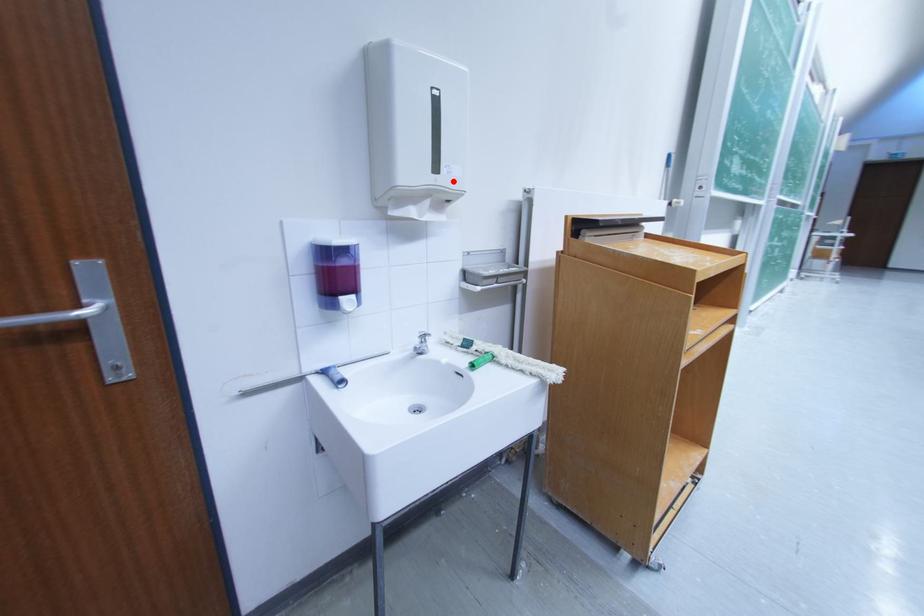
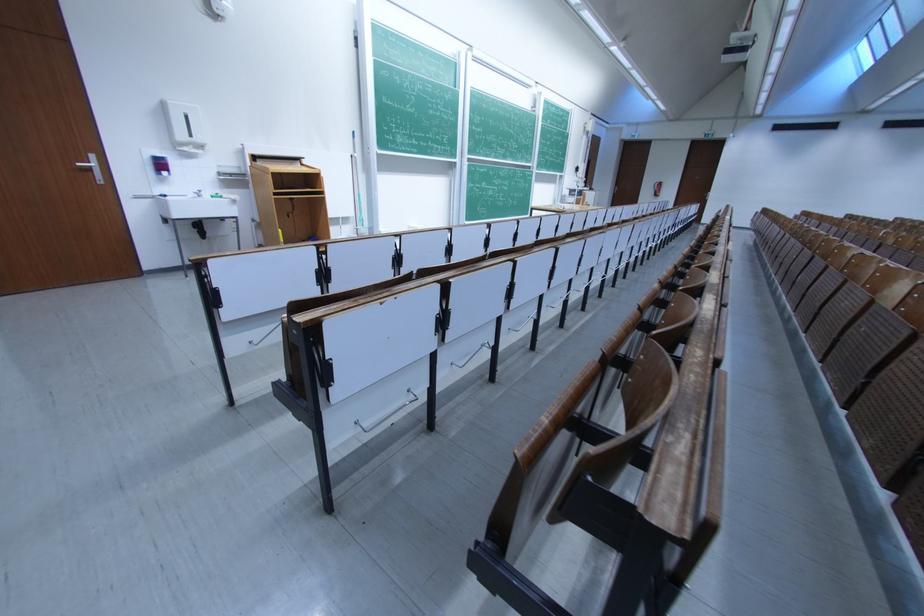
Where in the second image is the point corresponding to the highlighted location from the first image?

(205, 142)